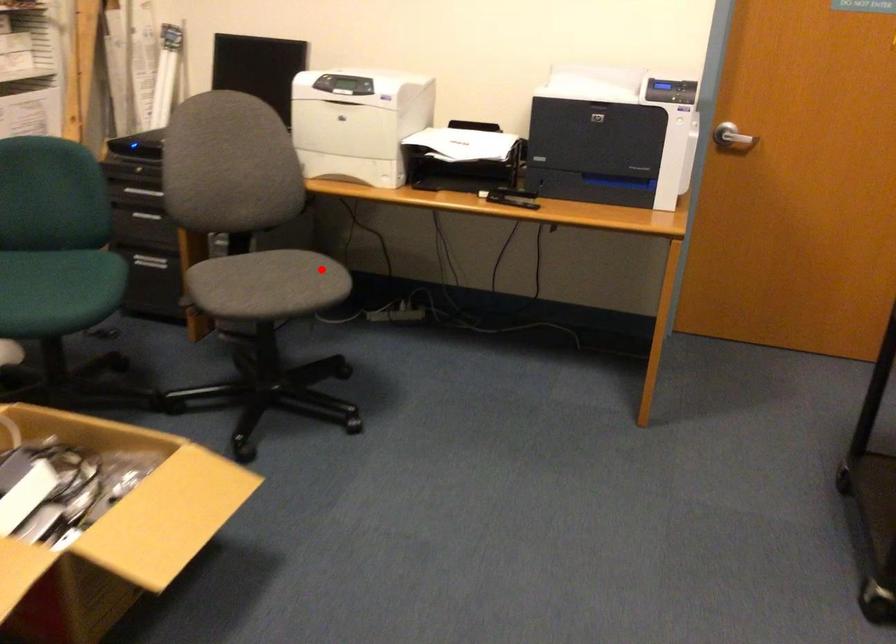
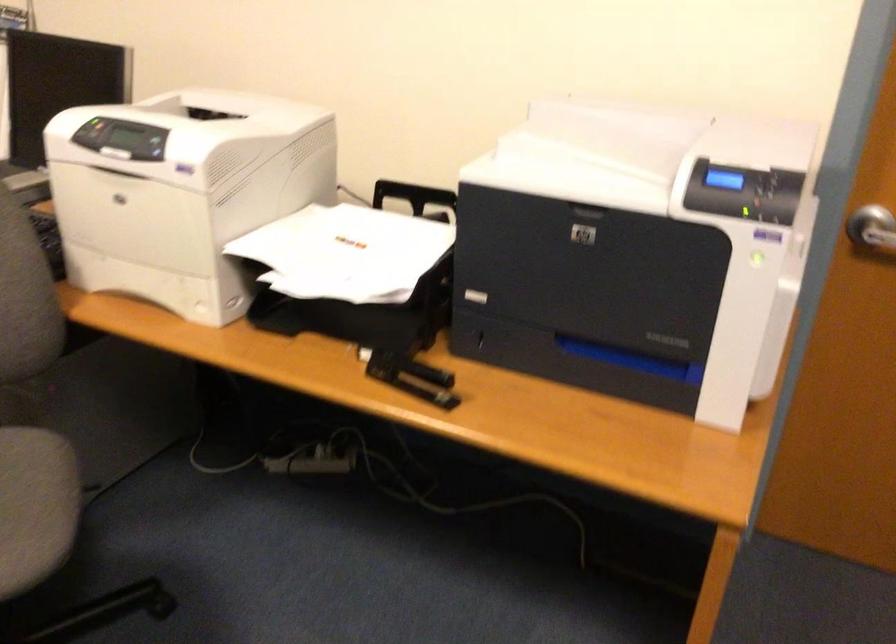
The point at the highlighted location is marked in the first image. Where is the corresponding point in the second image?

(35, 506)